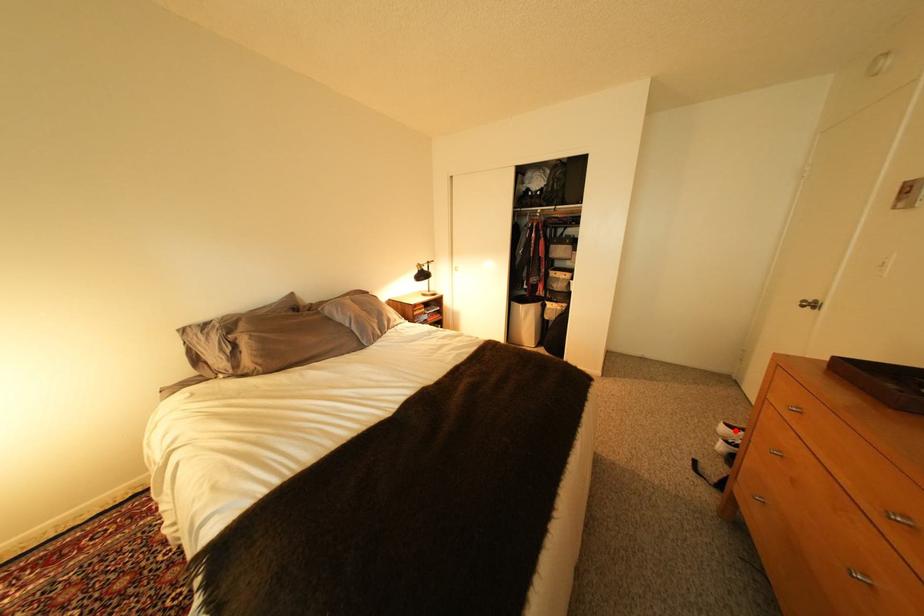
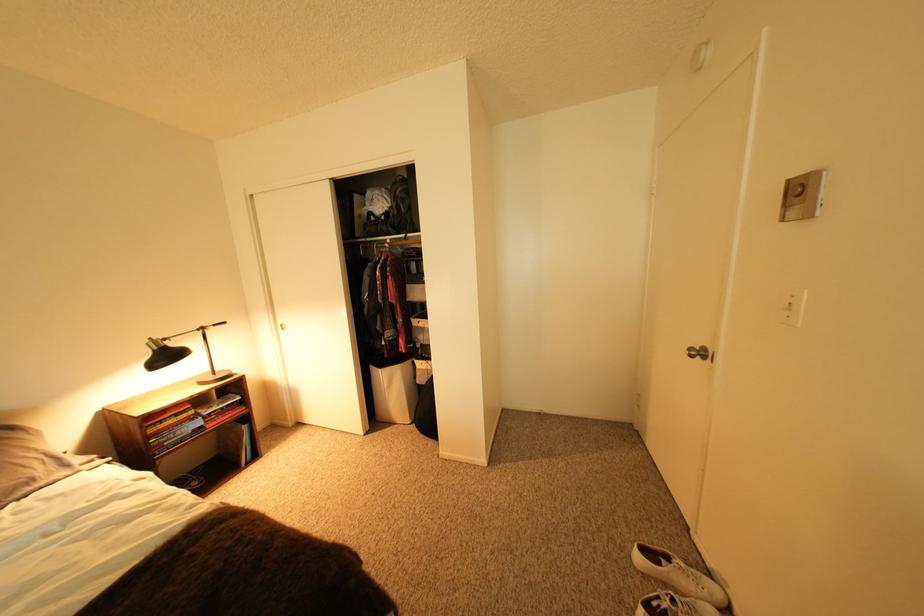
The point at the highlighted location is marked in the first image. Where is the corresponding point in the second image?

(651, 560)